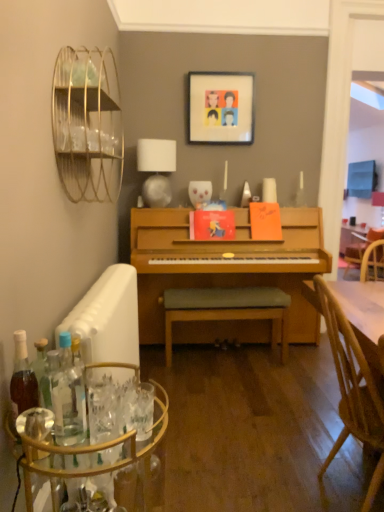
Question: From a real-world perspective, is clear glass bar cart at lower left positioned above or below white fabric lampshade at upper center?

Choices:
 (A) above
 (B) below

Answer: (B)

Question: In the image, is clear glass bar cart at lower left positioned in front of or behind white fabric lampshade at upper center?

Choices:
 (A) front
 (B) behind

Answer: (A)

Question: Which of these objects is positioned closest to the clear glass bar cart at lower left?

Choices:
 (A) light green fabric cushioned bench at center
 (B) matte plastic picture frame at upper center
 (C) clear glass bottle at lower left, which ranks as the first bottle in right-to-left order
 (D) white fabric lampshade at upper center
 (E) translucent glass bottle at lower left, which is counted as the first bottle, starting from the left

Answer: (C)

Question: Which of these objects is positioned farthest from the light brown wooden chair at right?

Choices:
 (A) light green fabric cushioned bench at center
 (B) matte plastic picture frame at upper center
 (C) translucent glass bottle at lower left, which is the 2th bottle from right to left
 (D) clear glass bar cart at lower left
 (E) clear glass bottle at lower left, which ranks as the first bottle in right-to-left order

Answer: (B)